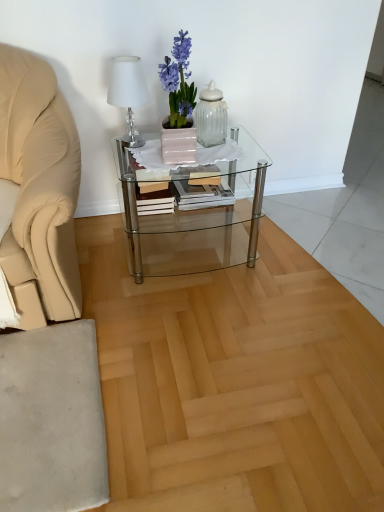
Where is `vacant space in front of clear glass coffee table at center`? vacant space in front of clear glass coffee table at center is located at coordinates (190, 316).